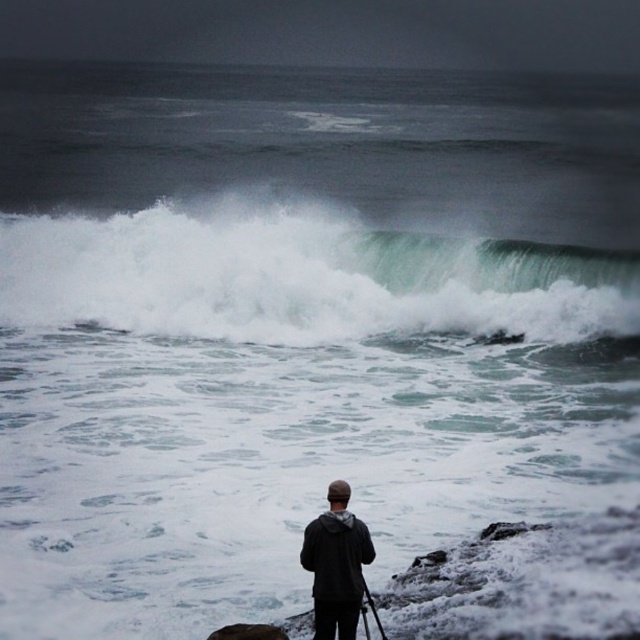
Question: Which of the following is the closest to the observer?

Choices:
 (A) white frothy wave at upper center
 (B) dark gray hoodie at center
 (C) black matte tripod at lower center

Answer: (B)

Question: Which point is closer to the camera taking this photo?

Choices:
 (A) (362, 609)
 (B) (362, 540)
 (C) (45, 250)

Answer: (B)

Question: Does white frothy wave at upper center have a greater width compared to dark gray hoodie at center?

Choices:
 (A) no
 (B) yes

Answer: (B)

Question: Does white frothy wave at upper center appear over dark gray hoodie at center?

Choices:
 (A) yes
 (B) no

Answer: (A)

Question: Is white frothy wave at upper center positioned at the back of black matte tripod at lower center?

Choices:
 (A) no
 (B) yes

Answer: (B)

Question: Which point is closer to the camera?

Choices:
 (A) black matte tripod at lower center
 (B) dark gray hoodie at center

Answer: (B)